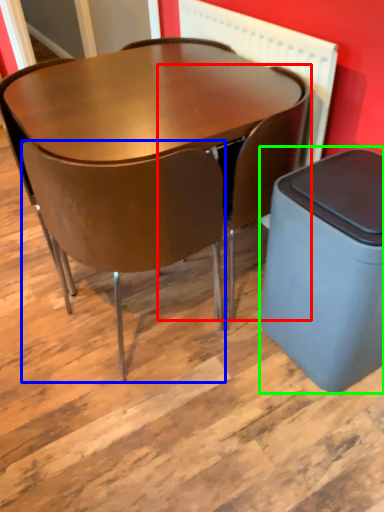
Question: Estimate the real-world distances between objects in this image. Which object is farther from chair (highlighted by a red box), chair (highlighted by a blue box) or waste container (highlighted by a green box)?

Choices:
 (A) chair
 (B) waste container

Answer: (A)